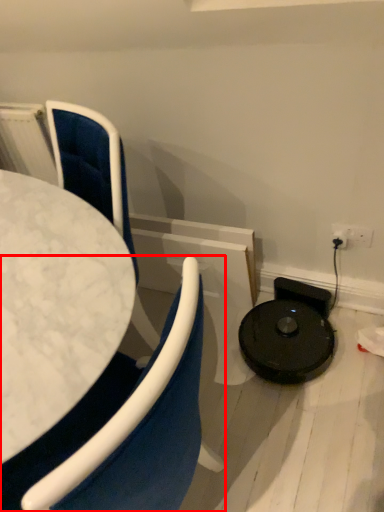
Question: From the image, what is the correct spatial relationship of chair (annotated by the red box) in relation to chair?

Choices:
 (A) right
 (B) left

Answer: (B)